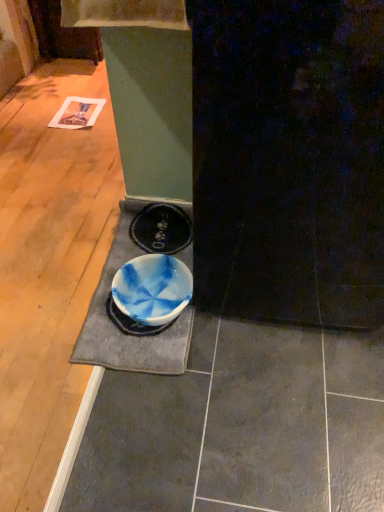
At what (x,y) coordinates should I click in order to perform the action: click on free location in front of blue marbled bowl at center. Please return your answer as a coordinate pair (x, y). Looking at the image, I should click on (149, 393).